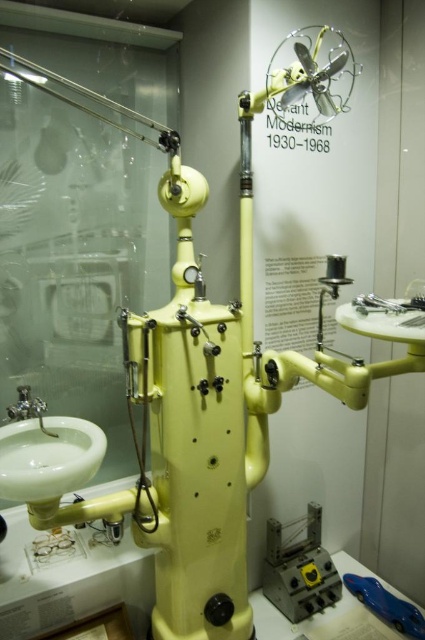
In the scene shown: You are a museum visitor standing in front of the vintage medical apparatus. You notice two points marked on the device. The first point is at coordinates point (96, 460) and the second is at point (387, 605). If you were to reach out and touch both points, which one would require you to stretch your arm further away from your body?

Point (387, 605) would require stretching your arm further because it is farther from the camera compared to point (96, 460), meaning it is located at a greater distance from your position as the observer.

You are a museum visitor who wants to wash your hands before touching the vintage medical apparatus. You see the white glossy sink at lower left and the brushed metal faucet at lower left. Which one should you turn on to get water flowing?

You should turn on the brushed metal faucet at lower left because it is the faucet, and the white glossy sink at lower left is the basin where the water flows into.